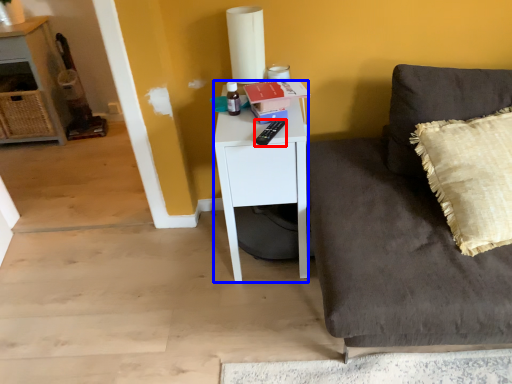
Question: Which of the following is the closest to the observer, remote control (highlighted by a red box) or desk (highlighted by a blue box)?

Choices:
 (A) remote control
 (B) desk

Answer: (A)